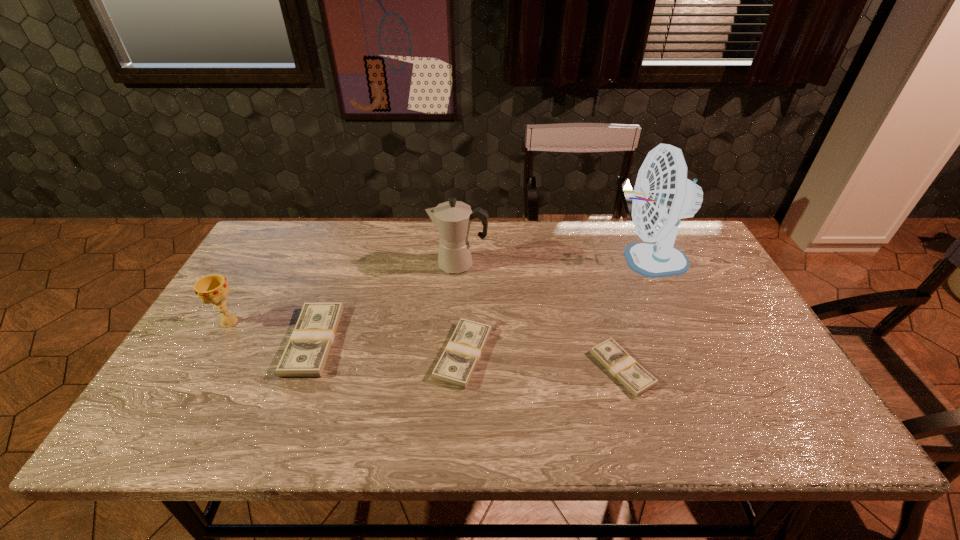
Identify the location of vacant spot to place a dollar on the right. (791, 383).